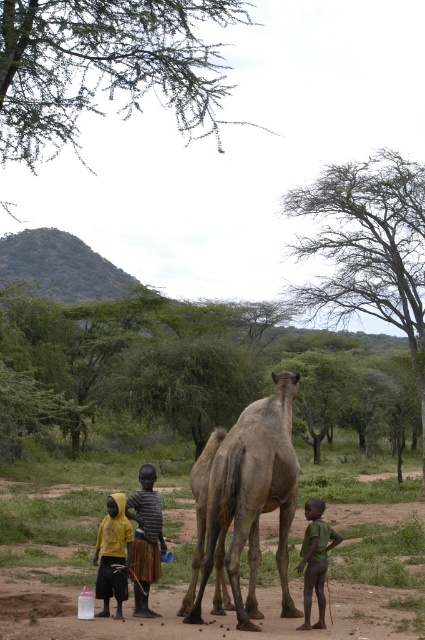
Question: Can you confirm if striped fabric shirt at center is positioned to the right of yellow matte shirt at lower left?

Choices:
 (A) yes
 (B) no

Answer: (A)

Question: Is striped fabric shirt at center positioned in front of dark skin/lean body at lower right?

Choices:
 (A) yes
 (B) no

Answer: (B)

Question: Estimate the real-world distances between objects in this image. Which object is farther from the brown textured camel at center?

Choices:
 (A) dark skin/lean body at lower right
 (B) brown dirt field at lower center
 (C) striped fabric shirt at center
 (D) yellow matte shirt at lower left

Answer: (B)

Question: Which is farther from the striped fabric shirt at center?

Choices:
 (A) brown dirt field at lower center
 (B) brown textured camel at center

Answer: (A)

Question: Which of the following is the farthest from the observer?

Choices:
 (A) dark skin/lean body at lower right
 (B) brown dirt field at lower center
 (C) striped fabric shirt at center
 (D) yellow matte shirt at lower left

Answer: (C)

Question: Can you confirm if brown textured camel at center is positioned to the left of striped fabric shirt at center?

Choices:
 (A) yes
 (B) no

Answer: (B)